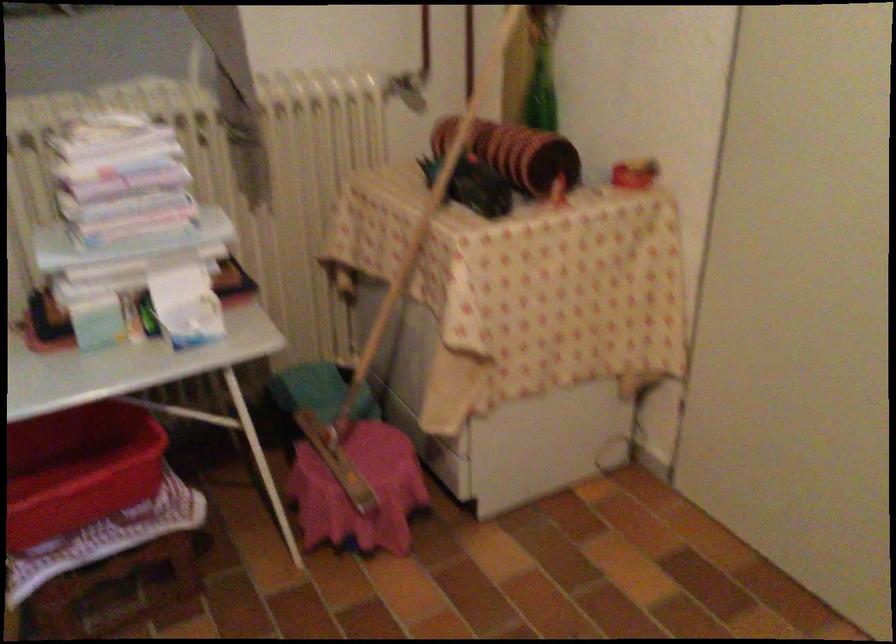
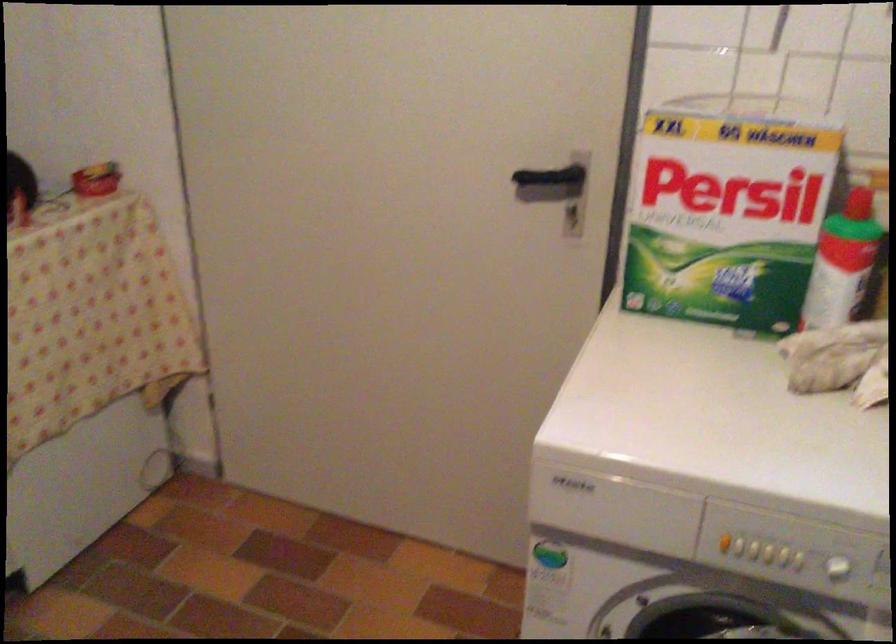
Question: The first image is from the beginning of the video and the second image is from the end. How did the camera likely rotate when shooting the video?

Choices:
 (A) Left
 (B) Right
 (C) Up
 (D) Down

Answer: (B)